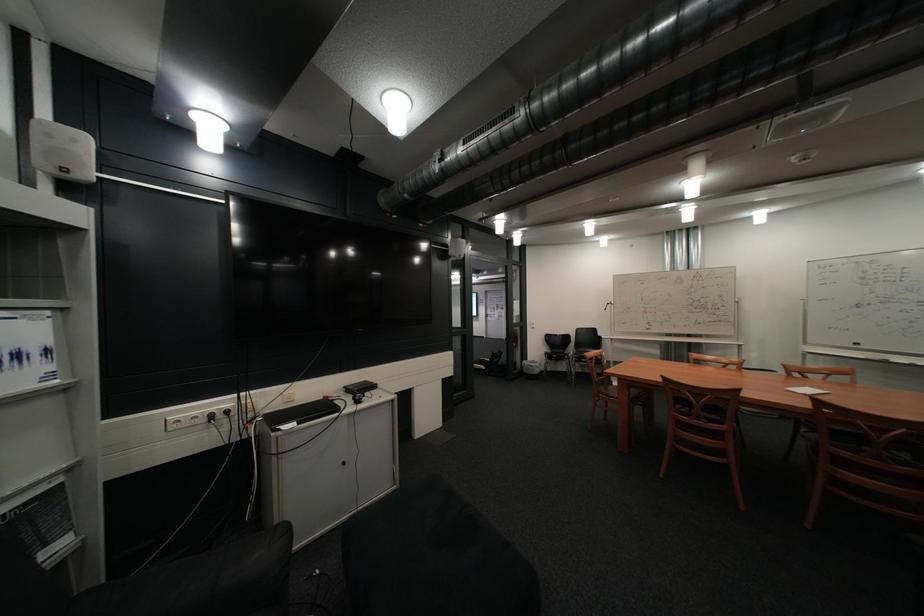
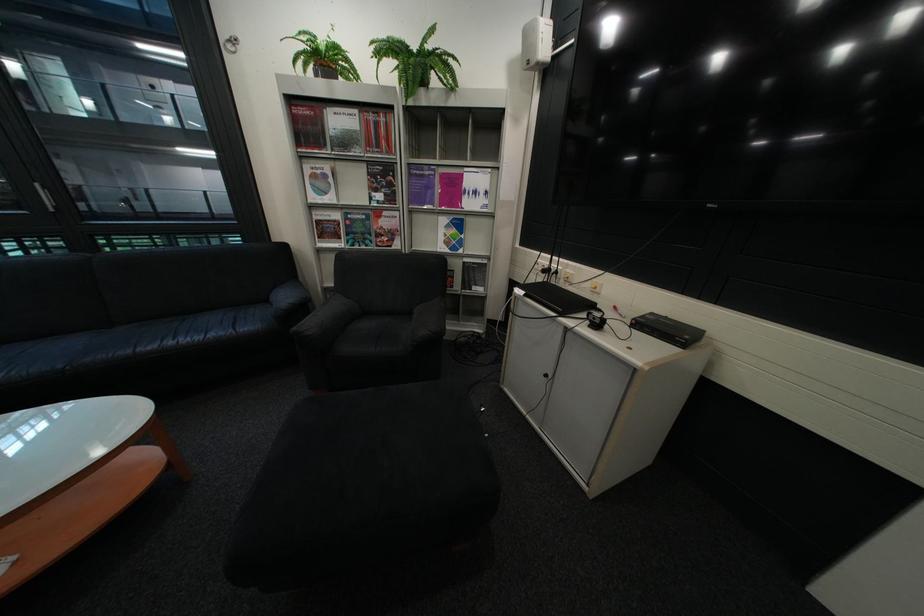
The point at (309,424) is marked in the first image. Where is the corresponding point in the second image?

(538, 293)